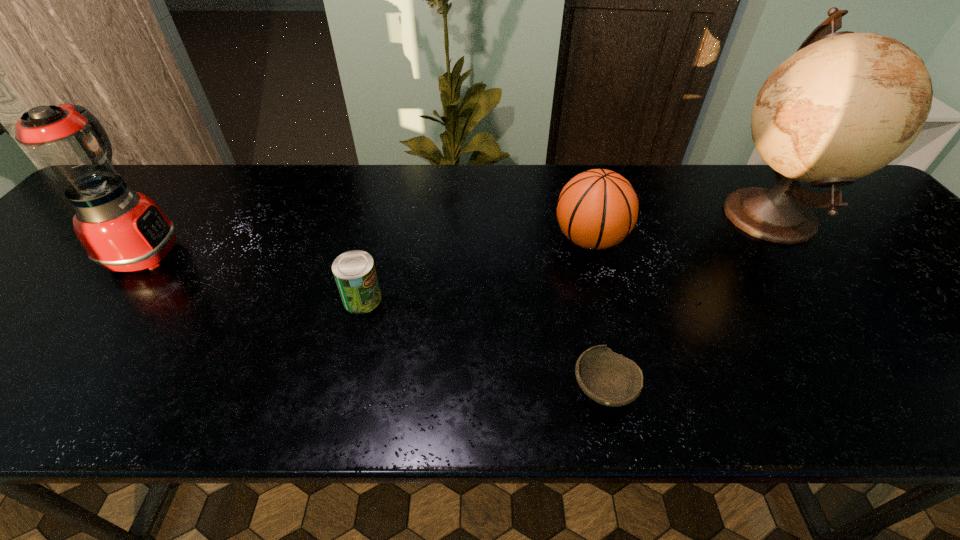
The image size is (960, 540). Find the location of `vacant space at the far edge of the desktop`. vacant space at the far edge of the desktop is located at coordinates (445, 168).

This screenshot has height=540, width=960. I want to click on free space at the near edge of the desktop, so click(x=730, y=397).

In the image, there is a desktop. Identify the location of vacant space at the left edge. (6, 369).

Find the location of a particular element. Image resolution: width=960 pixels, height=540 pixels. vacant space at the right edge of the desktop is located at coordinates (891, 261).

Where is `free space at the far left corner`? This screenshot has width=960, height=540. free space at the far left corner is located at coordinates (122, 178).

Identify the location of vacant space that is in between the basketball and the second object from left to right. This screenshot has height=540, width=960. (476, 269).

Identify the location of empty space that is in between the globe and the food processor. (457, 233).

Locate an element on the screen. The height and width of the screenshot is (540, 960). free area in between the fourth shortest object and the second shortest object is located at coordinates (254, 275).

Find the location of a particular element. free space between the third shortest object and the rightmost object is located at coordinates 679,227.

Where is `vacant region between the globe and the basketball`? vacant region between the globe and the basketball is located at coordinates (679, 227).